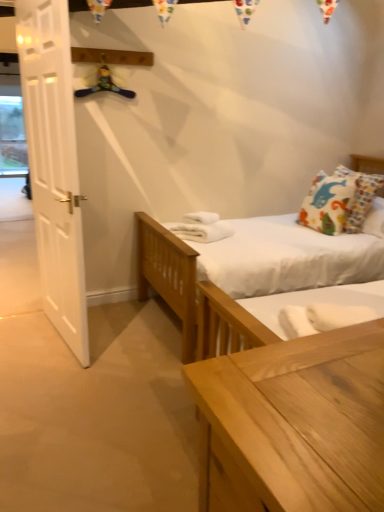
Question: Could printed fabric pillow at upper right be considered to be inside white wooden door at left?

Choices:
 (A) no
 (B) yes

Answer: (A)

Question: Can you confirm if white wooden door at left is thinner than printed fabric pillow at upper right?

Choices:
 (A) no
 (B) yes

Answer: (B)

Question: From the image's perspective, would you say white wooden door at left is shown under printed fabric pillow at upper right?

Choices:
 (A) yes
 (B) no

Answer: (A)

Question: Does white wooden door at left have a lesser height compared to printed fabric pillow at upper right?

Choices:
 (A) yes
 (B) no

Answer: (B)

Question: Is white wooden door at left turned away from printed fabric pillow at upper right?

Choices:
 (A) no
 (B) yes

Answer: (B)

Question: From a real-world perspective, is printed fabric pillow at upper right above or below white wooden door at left?

Choices:
 (A) below
 (B) above

Answer: (A)

Question: Is printed fabric pillow at upper right bigger or smaller than white wooden door at left?

Choices:
 (A) big
 (B) small

Answer: (A)

Question: In terms of width, does printed fabric pillow at upper right look wider or thinner when compared to white wooden door at left?

Choices:
 (A) wide
 (B) thin

Answer: (A)

Question: Would you say printed fabric pillow at upper right is inside or outside white wooden door at left?

Choices:
 (A) inside
 (B) outside

Answer: (B)

Question: Considering the positions of point (99, 75) and point (345, 198), is point (99, 75) closer or farther from the camera than point (345, 198)?

Choices:
 (A) farther
 (B) closer

Answer: (B)

Question: Relative to printed fabric pillow at upper right, is yellow fabric hanger at upper center in front or behind?

Choices:
 (A) behind
 (B) front

Answer: (B)

Question: In terms of height, does yellow fabric hanger at upper center look taller or shorter compared to printed fabric pillow at upper right?

Choices:
 (A) short
 (B) tall

Answer: (A)

Question: Based on their sizes in the image, would you say yellow fabric hanger at upper center is bigger or smaller than printed fabric pillow at upper right?

Choices:
 (A) big
 (B) small

Answer: (B)

Question: From a real-world perspective, relative to white wooden door at left, is yellow fabric hanger at upper center vertically above or below?

Choices:
 (A) below
 (B) above

Answer: (B)

Question: Is point (92, 92) positioned closer to the camera than point (82, 250)?

Choices:
 (A) farther
 (B) closer

Answer: (A)